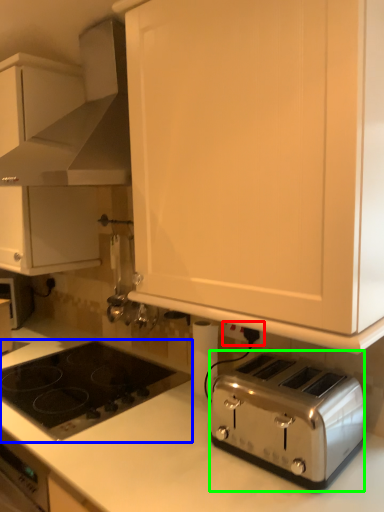
Question: Considering the real-world distances, which object is farthest from electric outlet (highlighted by a red box)? gas stove (highlighted by a blue box) or toaster (highlighted by a green box)?

Choices:
 (A) gas stove
 (B) toaster

Answer: (A)